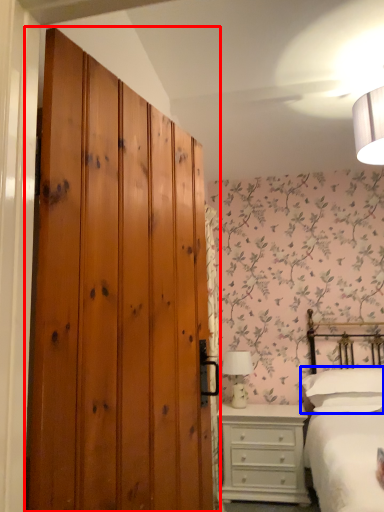
Question: Among these objects, which one is farthest to the camera, door (highlighted by a red box) or pillow (highlighted by a blue box)?

Choices:
 (A) door
 (B) pillow

Answer: (B)